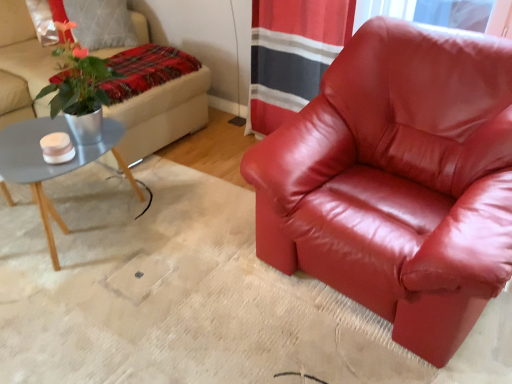
Describe the element at coordinates (398, 181) in the screenshot. I see `satin red armchair at center` at that location.

Locate an element on the screen. The image size is (512, 384). satin red armchair at center is located at coordinates (398, 181).

How much distance is there between plaid fabric blanket at upper left and satin red armchair at center?

A distance of 1.18 meters exists between plaid fabric blanket at upper left and satin red armchair at center.

Who is taller, plaid fabric blanket at upper left or satin red armchair at center?

With more height is satin red armchair at center.

Considering their positions, is plaid fabric blanket at upper left located in front of or behind satin red armchair at center?

Visually, plaid fabric blanket at upper left is located behind satin red armchair at center.

Is plaid fabric blanket at upper left beside satin red armchair at center?

No, plaid fabric blanket at upper left is not next to satin red armchair at center.

Is matte gray coffee table at left oriented towards plaid fabric blanket at upper left?

No, matte gray coffee table at left is not facing towards plaid fabric blanket at upper left.

Which of these two, matte gray coffee table at left or plaid fabric blanket at upper left, is smaller?

plaid fabric blanket at upper left.

Looking at this image, considering the positions of objects matte gray coffee table at left and plaid fabric blanket at upper left in the image provided, who is more to the left, matte gray coffee table at left or plaid fabric blanket at upper left?

From the viewer's perspective, matte gray coffee table at left appears more on the left side.

Looking at this image, is matte gray coffee table at left directly adjacent to plaid fabric blanket at upper left?

matte gray coffee table at left and plaid fabric blanket at upper left are not in contact.

Who is shorter, satin red armchair at center or matte gray coffee table at left?

With less height is matte gray coffee table at left.

Considering the sizes of satin red armchair at center and matte gray coffee table at left in the image, is satin red armchair at center wider or thinner than matte gray coffee table at left?

Clearly, satin red armchair at center has more width compared to matte gray coffee table at left.

Is satin red armchair at center beside matte gray coffee table at left?

No, satin red armchair at center is not with matte gray coffee table at left.

Which of these two, satin red armchair at center or plaid fabric blanket at upper left, is bigger?

satin red armchair at center.

Can you confirm if satin red armchair at center is shorter than plaid fabric blanket at upper left?

No, satin red armchair at center is not shorter than plaid fabric blanket at upper left.

Between satin red armchair at center and plaid fabric blanket at upper left, which one has larger width?

Wider between the two is satin red armchair at center.

I want to click on blanket located on the left of satin red armchair at center, so (x=146, y=68).

Between beige fabric studio couch at upper left and plaid fabric blanket at upper left, which one has smaller width?

Thinner between the two is plaid fabric blanket at upper left.

In terms of size, does beige fabric studio couch at upper left appear bigger or smaller than plaid fabric blanket at upper left?

Clearly, beige fabric studio couch at upper left is larger in size than plaid fabric blanket at upper left.

Is beige fabric studio couch at upper left to the left of plaid fabric blanket at upper left from the viewer's perspective?

Indeed, beige fabric studio couch at upper left is positioned on the left side of plaid fabric blanket at upper left.

Identify the location of blanket that is behind the beige fabric studio couch at upper left. click(146, 68).

Is beige fabric studio couch at upper left positioned far away from satin red armchair at center?

beige fabric studio couch at upper left is positioned a significant distance from satin red armchair at center.

Is point (128, 135) positioned behind point (496, 196)?

Yes.

Is beige fabric studio couch at upper left positioned with its back to satin red armchair at center?

beige fabric studio couch at upper left does not have its back to satin red armchair at center.

Relative to satin red armchair at center, is matte gray coffee table at left in front or behind?

matte gray coffee table at left is positioned farther from the viewer than satin red armchair at center.

From the image's perspective, which object appears higher, matte gray coffee table at left or satin red armchair at center?

From the image's view, satin red armchair at center is above.

Does matte gray coffee table at left have a larger size compared to satin red armchair at center?

Actually, matte gray coffee table at left might be smaller than satin red armchair at center.

Where is `blanket above the satin red armchair at center (from the image's perspective)`? This screenshot has height=384, width=512. blanket above the satin red armchair at center (from the image's perspective) is located at coordinates (146, 68).

In the image, there is a plaid fabric blanket at upper left. Where is `coffee table below it (from the image's perspective)`? The image size is (512, 384). coffee table below it (from the image's perspective) is located at coordinates (52, 165).

Looking at the image, which one is located further to plaid fabric blanket at upper left, satin red armchair at center or beige fabric studio couch at upper left?

satin red armchair at center.

Estimate the real-world distances between objects in this image. Which object is closer to plaid fabric blanket at upper left, beige fabric studio couch at upper left or matte gray coffee table at left?

Among the two, beige fabric studio couch at upper left is located nearer to plaid fabric blanket at upper left.

Estimate the real-world distances between objects in this image. Which object is further from matte gray coffee table at left, plaid fabric blanket at upper left or beige fabric studio couch at upper left?

The object further to matte gray coffee table at left is plaid fabric blanket at upper left.

Which object lies further to the anchor point matte gray coffee table at left, plaid fabric blanket at upper left or satin red armchair at center?

Among the two, satin red armchair at center is located further to matte gray coffee table at left.

Estimate the real-world distances between objects in this image. Which object is closer to satin red armchair at center, plaid fabric blanket at upper left or matte gray coffee table at left?

matte gray coffee table at left is positioned closer to the anchor satin red armchair at center.

When comparing their distances from satin red armchair at center, does matte gray coffee table at left or beige fabric studio couch at upper left seem closer?

matte gray coffee table at left is positioned closer to the anchor satin red armchair at center.

From the image, which object appears to be farther from beige fabric studio couch at upper left, plaid fabric blanket at upper left or matte gray coffee table at left?

Based on the image, matte gray coffee table at left appears to be further to beige fabric studio couch at upper left.

Which object lies nearer to the anchor point matte gray coffee table at left, satin red armchair at center or beige fabric studio couch at upper left?

Among the two, beige fabric studio couch at upper left is located nearer to matte gray coffee table at left.

Find the location of a particular element. The image size is (512, 384). blanket between matte gray coffee table at left and satin red armchair at center in the horizontal direction is located at coordinates (146, 68).

You are a GUI agent. You are given a task and a screenshot of the screen. Output one action in this format:
    pyautogui.click(x=<x>, y=<y>)
    Task: Click on the blanket between beige fabric studio couch at upper left and matte gray coffee table at left vertically
    Image resolution: width=512 pixels, height=384 pixels.
    Given the screenshot: What is the action you would take?
    pyautogui.click(x=146, y=68)

This screenshot has width=512, height=384. I want to click on blanket situated between beige fabric studio couch at upper left and satin red armchair at center from left to right, so tap(146, 68).

Find the location of a particular element. coffee table between beige fabric studio couch at upper left and satin red armchair at center is located at coordinates (52, 165).